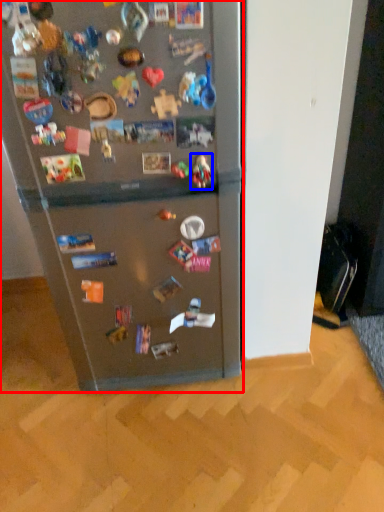
Question: Which point is closer to the camera, refrigerator (highlighted by a red box) or toy (highlighted by a blue box)?

Choices:
 (A) refrigerator
 (B) toy

Answer: (A)